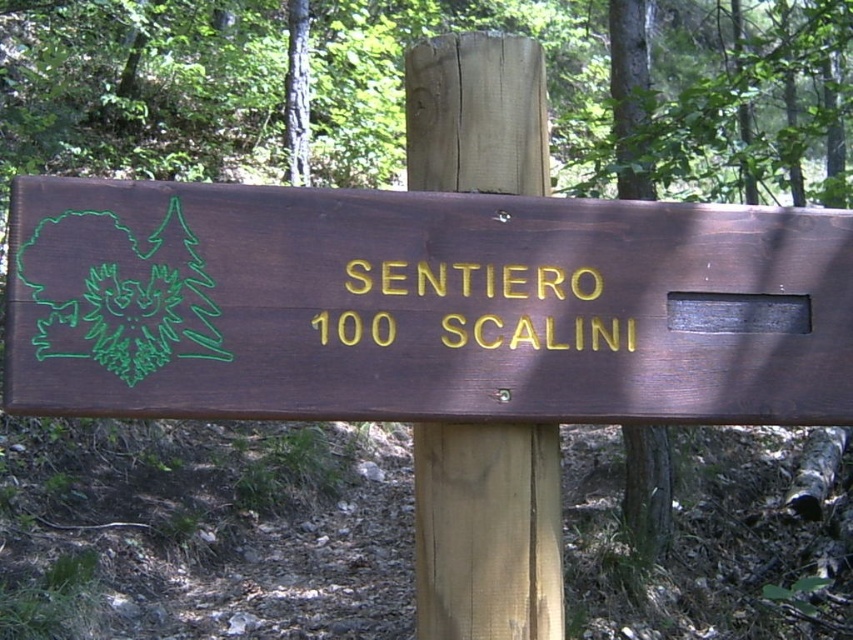
Does brown wood signpost at center appear on the left side of goldmaterial/texture sign at center?

Yes, brown wood signpost at center is to the left of goldmaterial/texture sign at center.

Is brown wood signpost at center bigger than goldmaterial/texture sign at center?

Indeed, brown wood signpost at center has a larger size compared to goldmaterial/texture sign at center.

The height and width of the screenshot is (640, 853). I want to click on brown wood signpost at center, so [x=486, y=531].

Is point (461, 120) farther from viewer compared to point (767, 308)?

Yes, it is behind point (767, 308).

Identify the location of brown wood signpost at center. This screenshot has width=853, height=640. pos(486,531).

Consider the image. Does goldmaterial/texture sign at center lie in front of dark brown wood sign at center?

Yes, goldmaterial/texture sign at center is in front of dark brown wood sign at center.

Between point (520, 282) and point (764, 292), which one is positioned behind?

The point (764, 292) is more distant.

Where is `goldmaterial/texture sign at center`? The image size is (853, 640). goldmaterial/texture sign at center is located at coordinates (469, 280).